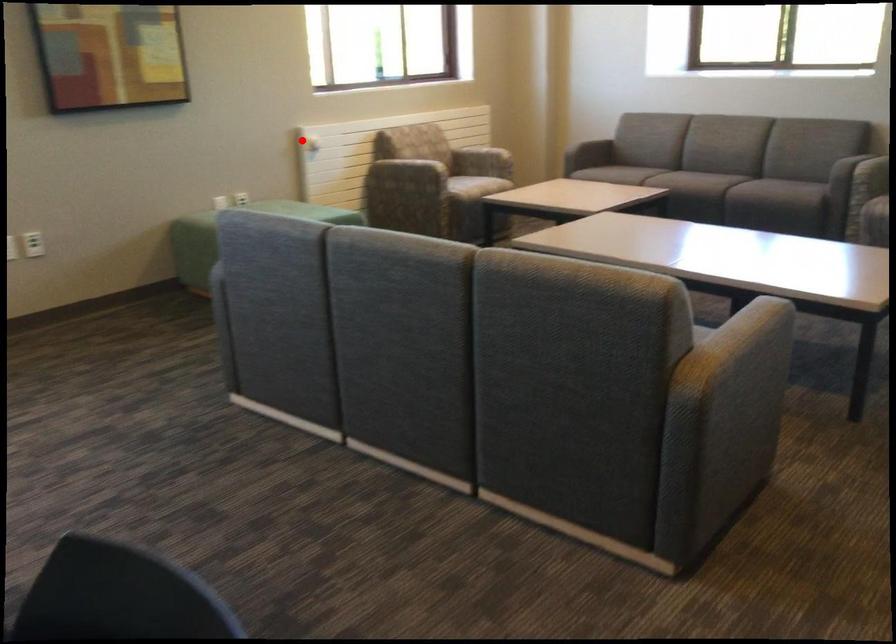
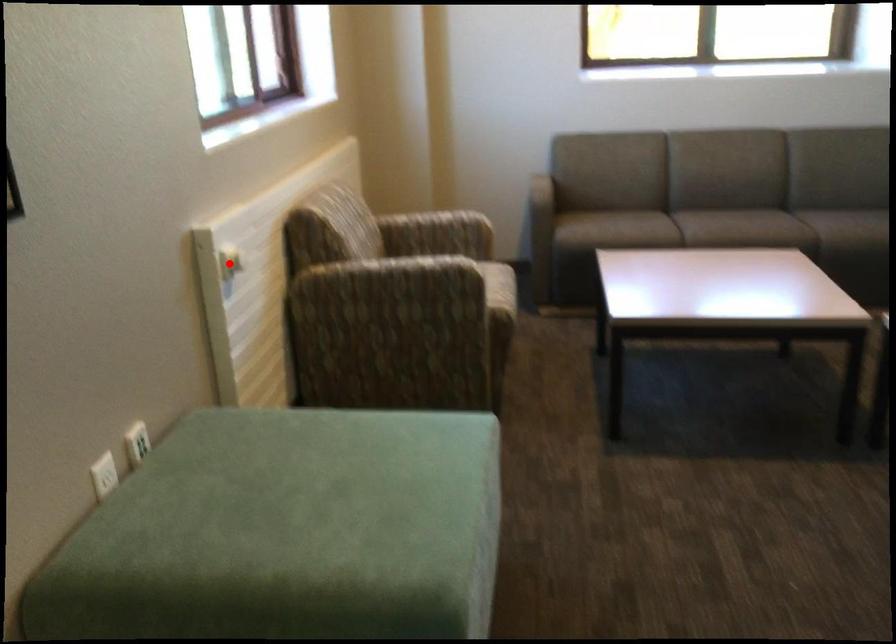
I am providing you with two images of the same scene from different viewpoints. A red point is marked on the first image and another point is marked on the second image. Are the points marked in image1 and image2 representing the same 3D position?

Yes